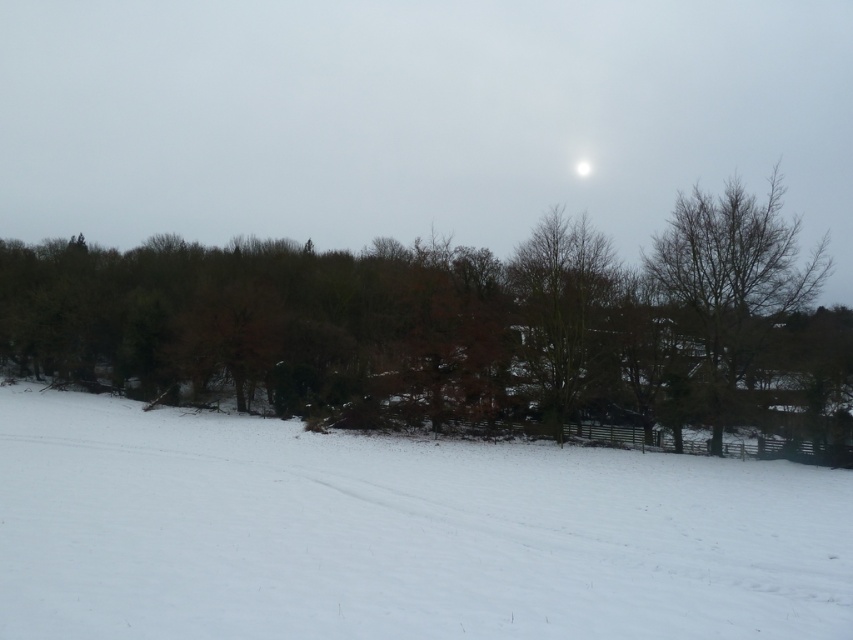
You are standing in the snowy landscape and want to walk from the bare branches at right to the bare branches at center. Which direction should you move to reach your destination?

You should move to the left to reach the bare branches at center from the bare branches at right because the bare branches at right is positioned on the right side of bare branches at center.

You are an observer standing in the snowy landscape. You notice a brown leafy tree at center and a bare branches at center. Which one is higher up in the scene?

The brown leafy tree at center is above the bare branches at center, so it is higher up in the scene.

You are standing in the snowy landscape and want to place a small flag at each of the two points marked in the image. Which point, point (480, 512) or point (575, 317), is closer to you where you should plant the flag first?

Point (480, 512) is closer to the camera than point (575, 317), so you should plant the flag at point (480, 512) first.